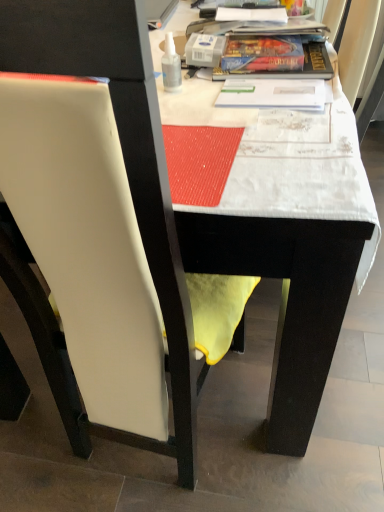
Image resolution: width=384 pixels, height=512 pixels. Identify the location of free spot to the right of transparent plastic bottle at upper center. (233, 87).